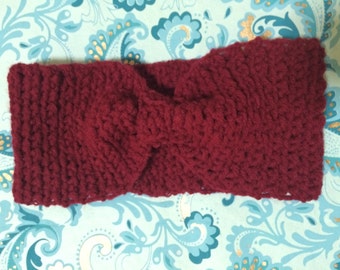
You are a GUI agent. You are given a task and a screenshot of the screen. Output one action in this format:
    pyautogui.click(x=<x>, y=<y>)
    Task: Click on the bed sheet
    Image resolution: width=340 pixels, height=270 pixels.
    Given the screenshot: What is the action you would take?
    pyautogui.click(x=46, y=254)